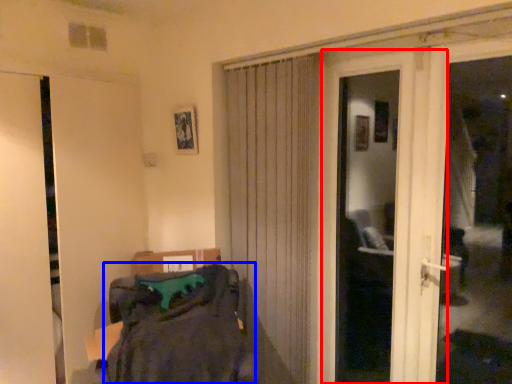
Question: Among these objects, which one is farthest to the camera, door (highlighted by a red box) or laundry (highlighted by a blue box)?

Choices:
 (A) door
 (B) laundry

Answer: (A)